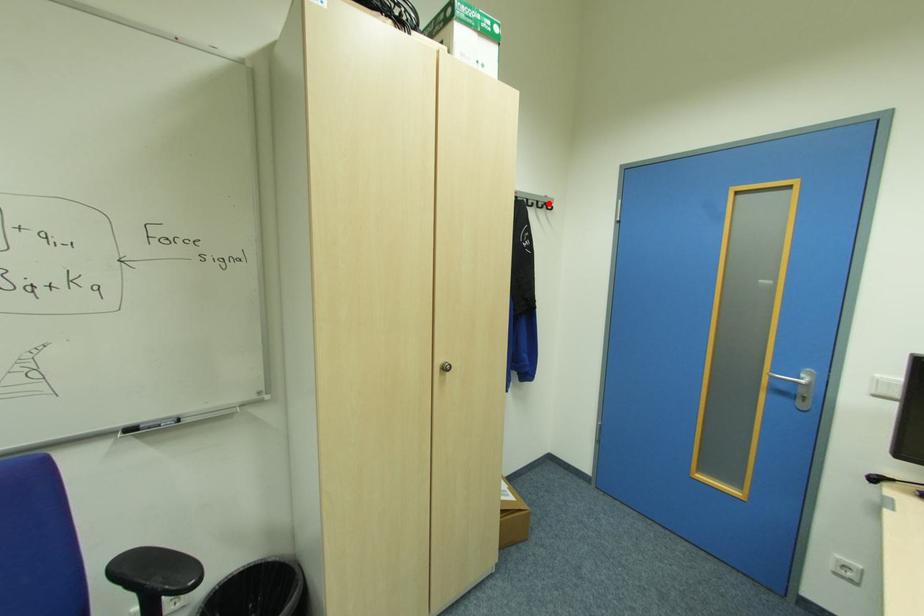
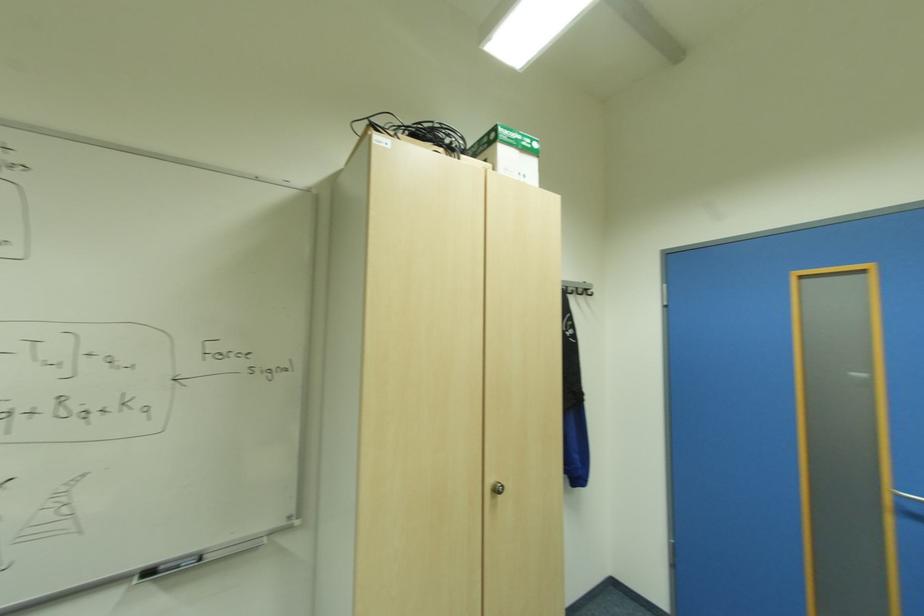
The point at the highlighted location is marked in the first image. Where is the corresponding point in the second image?

(588, 291)